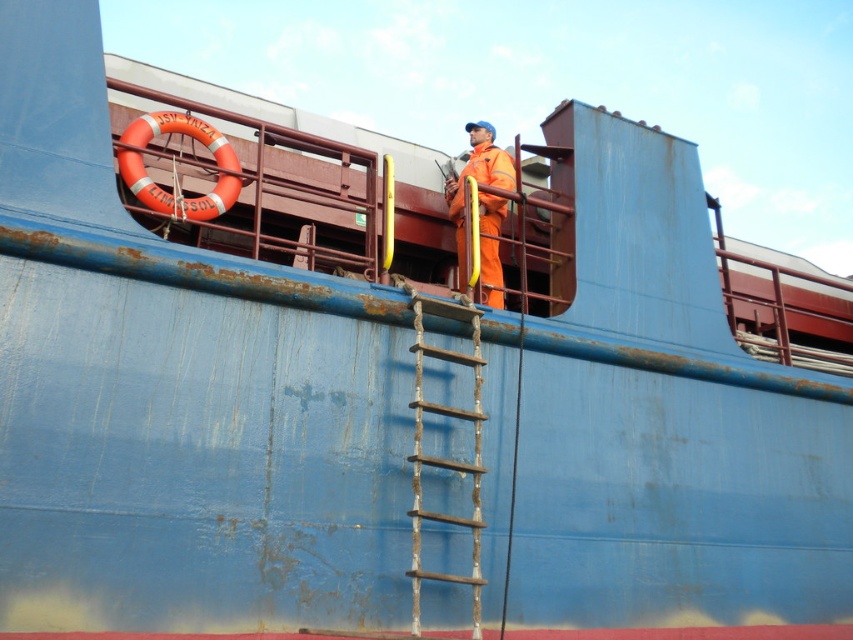
You are a crew member on the ship deck. You need to climb up the rusty wood ladder at center to reach the orange matte safety suit at center. Is the ladder positioned in a way that allows you to climb up to the safety suit?

The rusty wood ladder at center is located below the orange matte safety suit at center, so yes, the ladder is positioned correctly to climb up to the safety suit.

You are a crew member on the ship deck. You need to climb the rusty wood ladder at center to reach the upper deck. However, there is an orange matte safety suit at center in your path. Can you safely climb the ladder without moving the safety suit?

The rusty wood ladder at center is in front of the orange matte safety suit at center, meaning the ladder is closer to you than the safety suit. Therefore, you can safely climb the ladder without needing to move the safety suit as it is behind you.